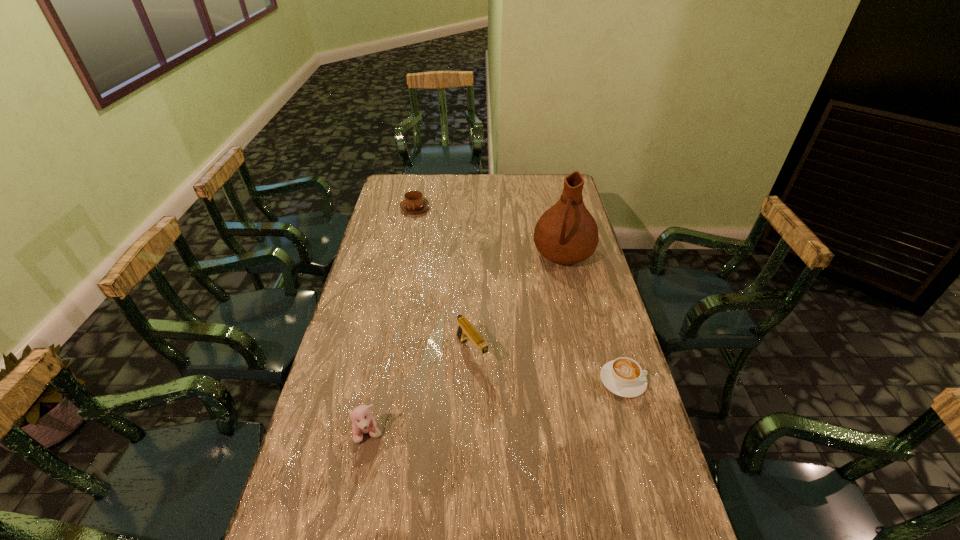
This screenshot has height=540, width=960. I want to click on vacant region located on the side of the left cappuccino with the handle, so (428, 230).

Locate an element on the screen. vacant space located 0.370m on the side of the left cappuccino with the handle is located at coordinates (449, 264).

Find the location of a particular element. vacant space located 0.050m at the barrel of the pistol is located at coordinates (x=489, y=379).

At what (x,y) coordinates should I click in order to perform the action: click on free location located at the barrel of the pistol. Please return your answer as a coordinate pair (x, y). Looking at the image, I should click on (518, 417).

Where is `vacant space situated at the barrel of the pistol`? The height and width of the screenshot is (540, 960). vacant space situated at the barrel of the pistol is located at coordinates (527, 429).

Identify the location of vacant space located on the side of the pitcher with the handle. This screenshot has width=960, height=540. (544, 320).

Identify the location of vacant space situated on the side of the pitcher with the handle. The height and width of the screenshot is (540, 960). [x=539, y=339].

I want to click on vacant space located 0.300m on the side of the pitcher with the handle, so click(541, 330).

Locate an element on the screen. teddy bear at the left edge is located at coordinates (363, 422).

You are a GUI agent. You are given a task and a screenshot of the screen. Output one action in this format:
    pyautogui.click(x=<x>, y=<y>)
    Task: Click on the cappuccino that is at the left edge
    This screenshot has width=960, height=540.
    Given the screenshot: What is the action you would take?
    pyautogui.click(x=414, y=202)